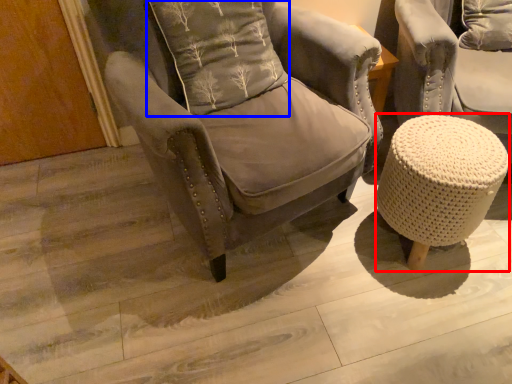
Question: Which object appears closest to the camera in this image, bar stool (highlighted by a red box) or pillow (highlighted by a blue box)?

Choices:
 (A) bar stool
 (B) pillow

Answer: (B)